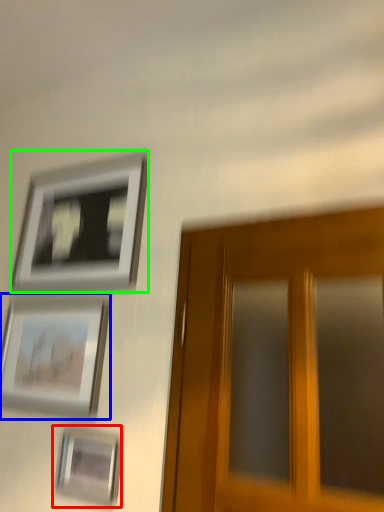
Question: Which object is positioned farthest from picture frame (highlighted by a red box)? Select from picture frame (highlighted by a blue box) and picture frame (highlighted by a green box).

Choices:
 (A) picture frame
 (B) picture frame

Answer: (B)